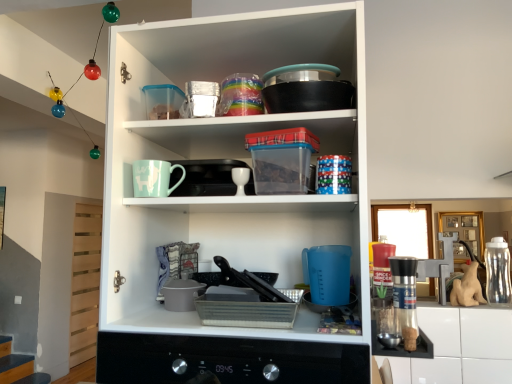
Question: Could you tell me if shiny metallic container at upper center, the first tableware positioned from the left, is facing matte ceramic mug at upper center?

Choices:
 (A) yes
 (B) no

Answer: (B)

Question: Is shiny metallic container at upper center, the first tableware positioned from the left, completely or partially outside of matte ceramic mug at upper center?

Choices:
 (A) yes
 (B) no

Answer: (A)

Question: Does shiny metallic container at upper center, which is the 2th tableware from right to left, have a larger size compared to matte ceramic mug at upper center?

Choices:
 (A) yes
 (B) no

Answer: (B)

Question: Is shiny metallic container at upper center, the first tableware positioned from the left, touching matte ceramic mug at upper center?

Choices:
 (A) no
 (B) yes

Answer: (A)

Question: Can you confirm if shiny metallic container at upper center, which is the 2th tableware from right to left, is wider than matte ceramic mug at upper center?

Choices:
 (A) no
 (B) yes

Answer: (A)

Question: From a real-world perspective, is white glossy egg cup at center, placed as the 2th tableware when sorted from left to right, beneath matte white cupboard at center?

Choices:
 (A) yes
 (B) no

Answer: (B)

Question: Can you confirm if white glossy egg cup at center, which is the first tableware from bottom to top, is taller than matte white cupboard at center?

Choices:
 (A) no
 (B) yes

Answer: (A)

Question: Considering the relative positions of white glossy egg cup at center, the 1th tableware viewed from the right, and matte white cupboard at center in the image provided, is white glossy egg cup at center, the 1th tableware viewed from the right, to the left of matte white cupboard at center from the viewer's perspective?

Choices:
 (A) no
 (B) yes

Answer: (B)

Question: Is matte white cupboard at center located within white glossy egg cup at center, the 1th tableware viewed from the right?

Choices:
 (A) no
 (B) yes

Answer: (A)

Question: From a real-world perspective, is white glossy egg cup at center, which is the first tableware from bottom to top, on top of matte white cupboard at center?

Choices:
 (A) yes
 (B) no

Answer: (A)

Question: From the image's perspective, is white glossy egg cup at center, the 2th tableware positioned from the top, beneath matte white cupboard at center?

Choices:
 (A) no
 (B) yes

Answer: (A)

Question: Is metallic black oven at center at the left side of matte ceramic mug at upper center?

Choices:
 (A) no
 (B) yes

Answer: (A)